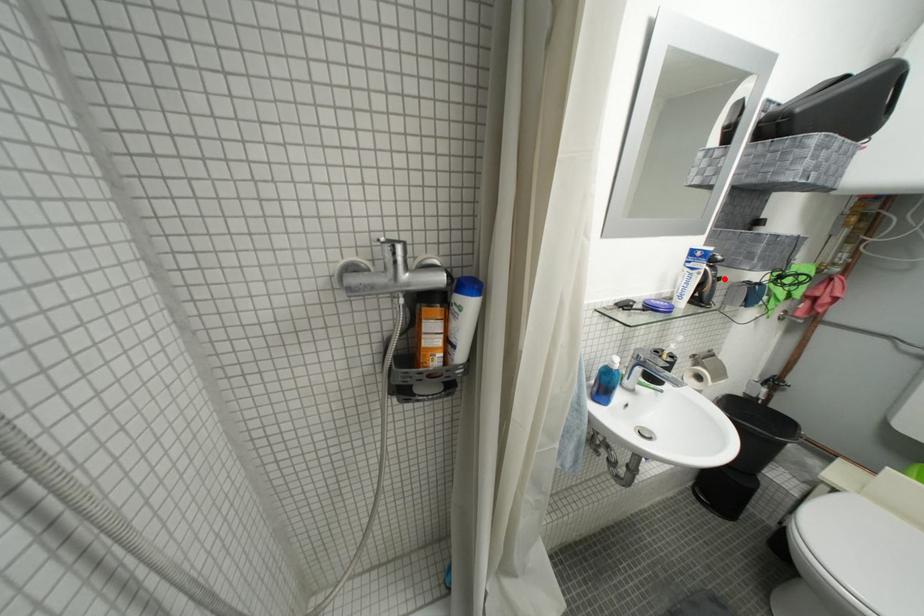
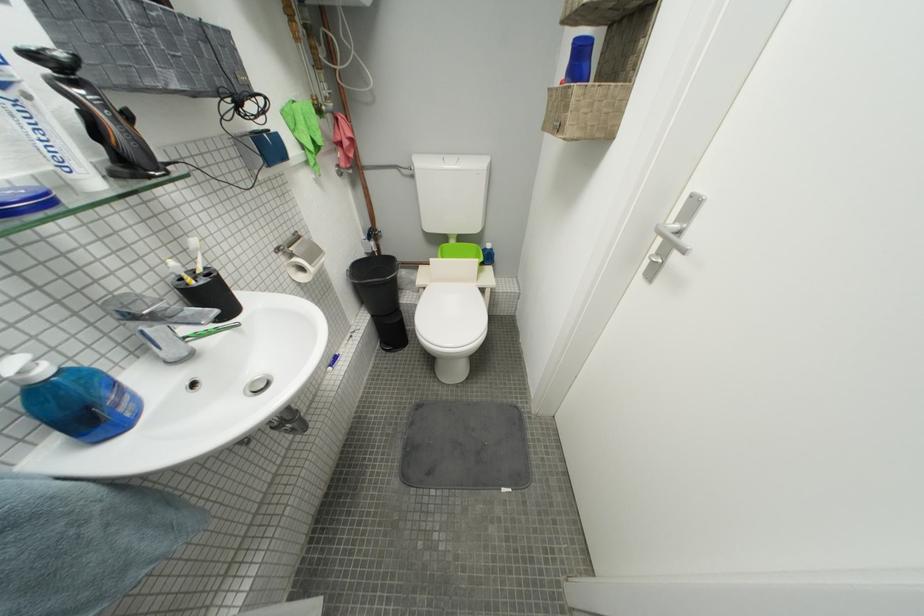
Find the pixel in the second image that matches the highlighted location in the first image.

(114, 108)